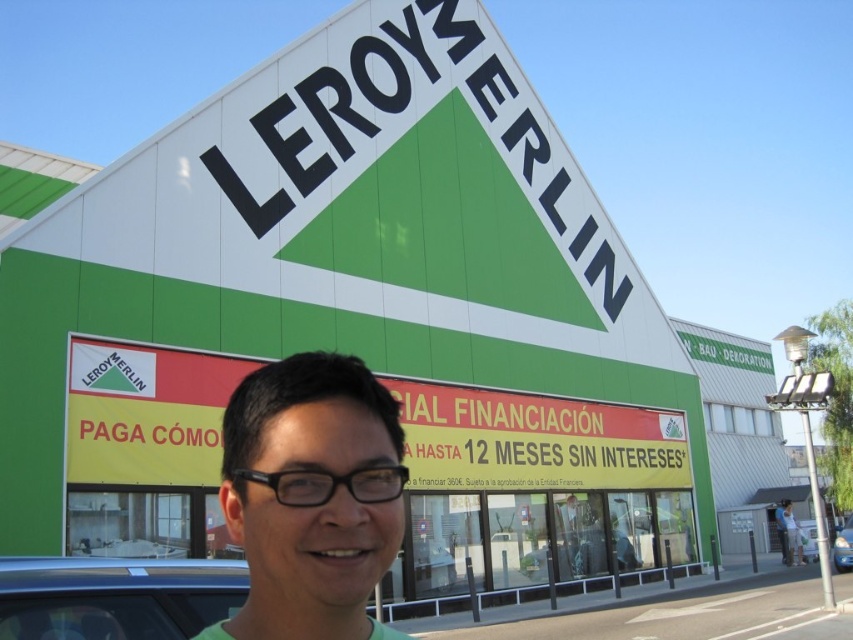
Does green matte shirt at center appear over metallic silver car at lower left?

Yes, green matte shirt at center is above metallic silver car at lower left.

Is green matte shirt at center closer to the viewer compared to metallic silver car at lower left?

Yes, it is in front of metallic silver car at lower left.

Locate an element on the screen. The width and height of the screenshot is (853, 640). green matte shirt at center is located at coordinates (311, 497).

Can you confirm if metallic silver car at lower left is positioned below metallic silver car at center?

No.

Does point (45, 637) lie in front of point (839, 540)?

Yes.

Which is in front, point (126, 602) or point (834, 540)?

Point (126, 602) is in front.

Identify the location of metallic silver car at lower left. The width and height of the screenshot is (853, 640). (115, 596).

Is metallic silver car at lower left bigger than matte black glasses at center?

No.

Between point (180, 598) and point (796, 563), which one is positioned in front?

Positioned in front is point (180, 598).

The image size is (853, 640). What do you see at coordinates (115, 596) in the screenshot? I see `metallic silver car at lower left` at bounding box center [115, 596].

Locate an element on the screen. metallic silver car at lower left is located at coordinates (115, 596).